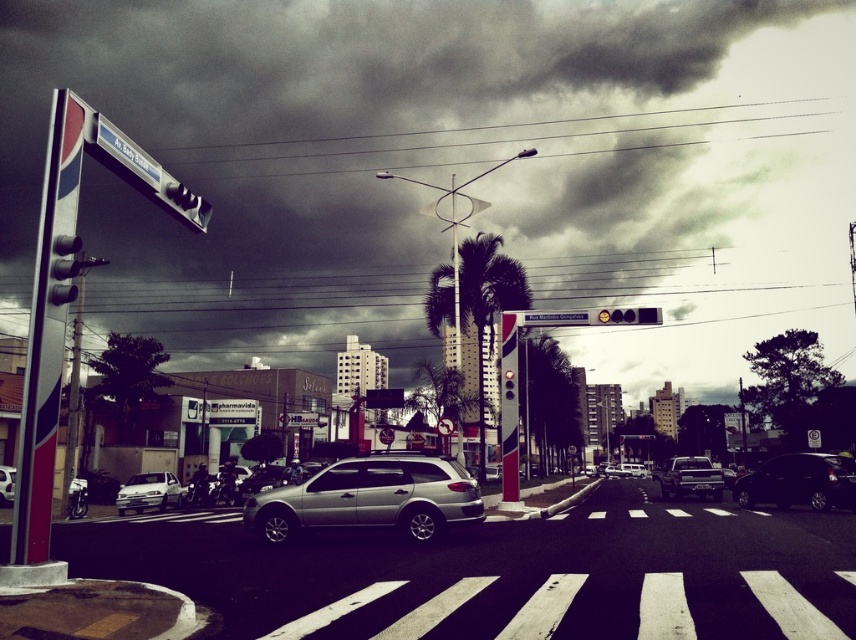
Does satin silver car at center come in front of metallic rectangular traffic light at center?

Yes, satin silver car at center is in front of metallic rectangular traffic light at center.

Who is positioned more to the right, satin silver car at center or metallic rectangular traffic light at center?

metallic rectangular traffic light at center is more to the right.

Does point (259, 513) lie in front of point (651, 310)?

Yes, it is in front of point (651, 310).

Locate an element on the screen. The height and width of the screenshot is (640, 856). satin silver car at center is located at coordinates (370, 497).

Does metallic silver truck at center have a greater height compared to silver metallic sedan at lower left?

Yes, metallic silver truck at center is taller than silver metallic sedan at lower left.

Who is lower down, metallic silver truck at center or silver metallic sedan at lower left?

metallic silver truck at center

Is point (676, 488) in front of point (163, 488)?

Yes.

Locate an element on the screen. This screenshot has height=640, width=856. metallic silver truck at center is located at coordinates (690, 477).

Is metallic silver truck at center bigger than silver metallic suv at center?

Yes.

Is metallic silver truck at center further to the viewer compared to silver metallic suv at center?

No.

At what (x,y) coordinates should I click in order to perform the action: click on metallic silver truck at center. Please return your answer as a coordinate pair (x, y). The image size is (856, 640). Looking at the image, I should click on (690, 477).